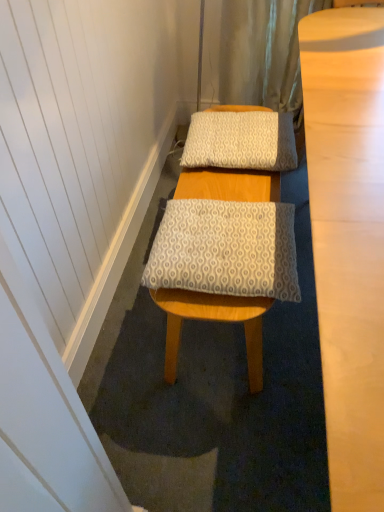
In order to click on vacant region under patterned fabric pillow at center, marked as the 1th pillow in a bottom-to-top arrangement (from a real-world perspective) in this screenshot , I will do point(210,350).